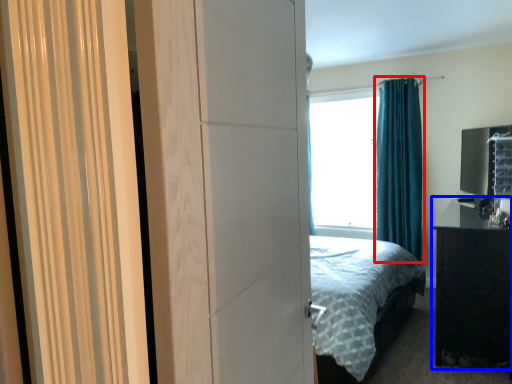
Question: Which point is further to the camera, curtain (highlighted by a red box) or nightstand (highlighted by a blue box)?

Choices:
 (A) curtain
 (B) nightstand

Answer: (A)